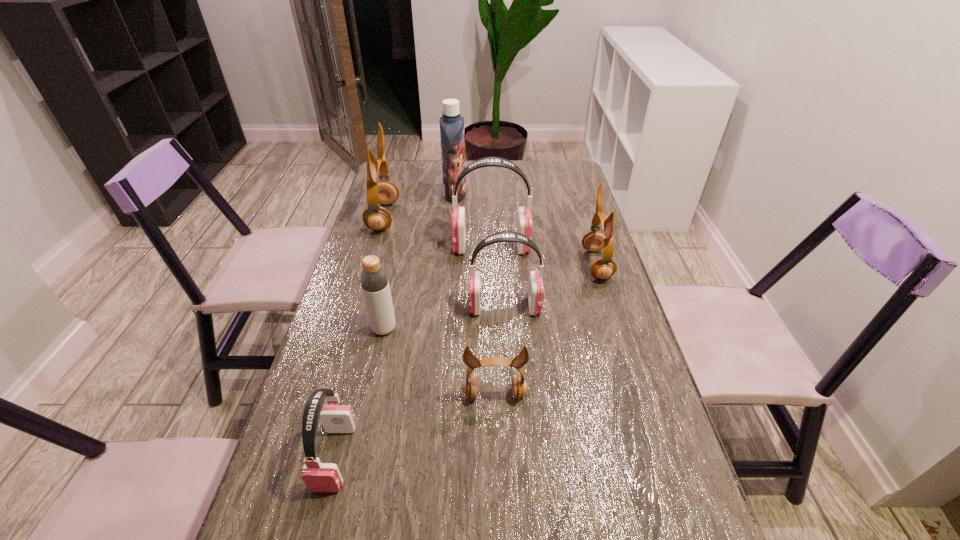
Identify the location of object that is the third nearest to the bottle. (318, 477).

Locate an element on the screen. The image size is (960, 540). the fourth closest object to the smallest pink earphone is located at coordinates (524, 220).

Select which earphone appears as the second closest to the nearest object. Please provide its 2D coordinates. Your answer should be formatted as a tuple, i.e. [(x, y)], where the tuple contains the x and y coordinates of a point satisfying the conditions above.

[(535, 288)]

Image resolution: width=960 pixels, height=540 pixels. Identify the location of earphone that stands as the fourth closest to the smallest brown earphone. (524, 220).

Choose which brown earphone is the second nearest neighbor to the leftmost brown earphone. Please provide its 2D coordinates. Your answer should be formatted as a tuple, i.e. [(x, y)], where the tuple contains the x and y coordinates of a point satisfying the conditions above.

[(469, 387)]

Identify which brown earphone is located as the nearest to the farthest pink earphone. Please provide its 2D coordinates. Your answer should be formatted as a tuple, i.e. [(x, y)], where the tuple contains the x and y coordinates of a point satisfying the conditions above.

[(595, 240)]

Identify which pink earphone is located as the nearest to the rightmost earphone. Please provide its 2D coordinates. Your answer should be formatted as a tuple, i.e. [(x, y)], where the tuple contains the x and y coordinates of a point satisfying the conditions above.

[(535, 288)]

Identify which pink earphone is the second nearest to the biggest pink earphone. Please provide its 2D coordinates. Your answer should be formatted as a tuple, i.e. [(x, y)], where the tuple contains the x and y coordinates of a point satisfying the conditions above.

[(318, 477)]

Locate an element on the screen. free space that satisfies the following two spatial constraints: 1. on the front-facing side of the second farthest brown earphone; 2. on the outer surface of the nearest pink earphone is located at coordinates (657, 457).

The width and height of the screenshot is (960, 540). Find the location of `vacant point that satisfies the following two spatial constraints: 1. on the front label of the shampoo; 2. on the outer surface of the smallest pink earphone`. vacant point that satisfies the following two spatial constraints: 1. on the front label of the shampoo; 2. on the outer surface of the smallest pink earphone is located at coordinates (433, 457).